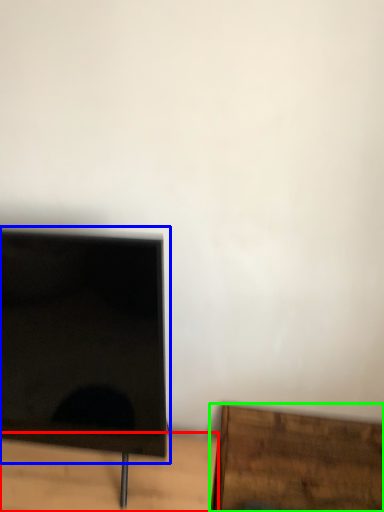
Question: Which object is the closest to the table (highlighted by a red box)? Choose among these: computer monitor (highlighted by a blue box) or furniture (highlighted by a green box).

Choices:
 (A) computer monitor
 (B) furniture

Answer: (A)